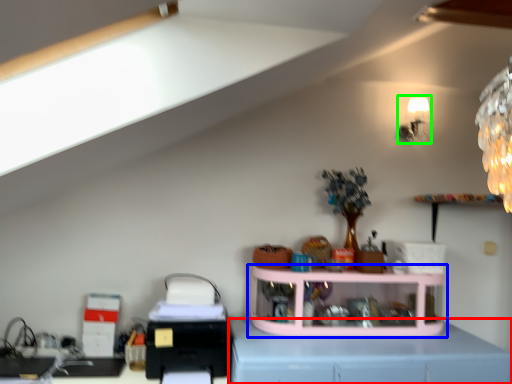
Question: Based on their relative distances, which object is nearer to computer desk (highlighted by a red box)? Choose from shelf (highlighted by a blue box) and lamp (highlighted by a green box).

Choices:
 (A) shelf
 (B) lamp

Answer: (A)